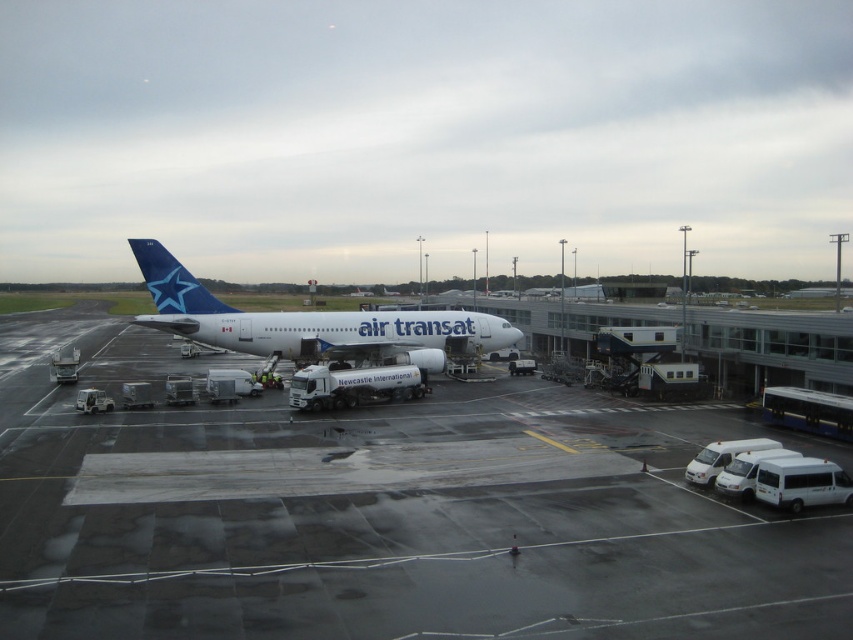
You are standing on the airport tarmac and want to take a photo of the white glossy airplane at center. However, there is a smooth asphalt tarmac at center blocking your view. Can you still see the airplane clearly through the tarmac?

The smooth asphalt tarmac at center is closer to the viewer than the white glossy airplane at center, so the tarmac would block the view of the airplane.

From the picture: You are a ground crew member who needs to direct a service vehicle to the left side of the white glossy airplane at center. Given the smooth asphalt tarmac at center is on the right side of the airplane, where should you direct the vehicle to park?

You should direct the service vehicle to park on the left side of the white glossy airplane at center, opposite to the smooth asphalt tarmac at center which is on the right side.